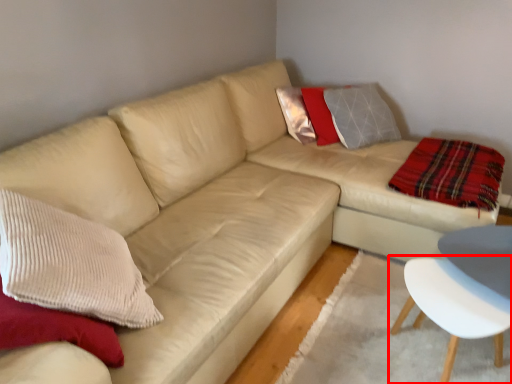
Question: From the image's perspective, what is the correct spatial positioning of chair (annotated by the red box) in reference to plaid?

Choices:
 (A) below
 (B) above

Answer: (A)